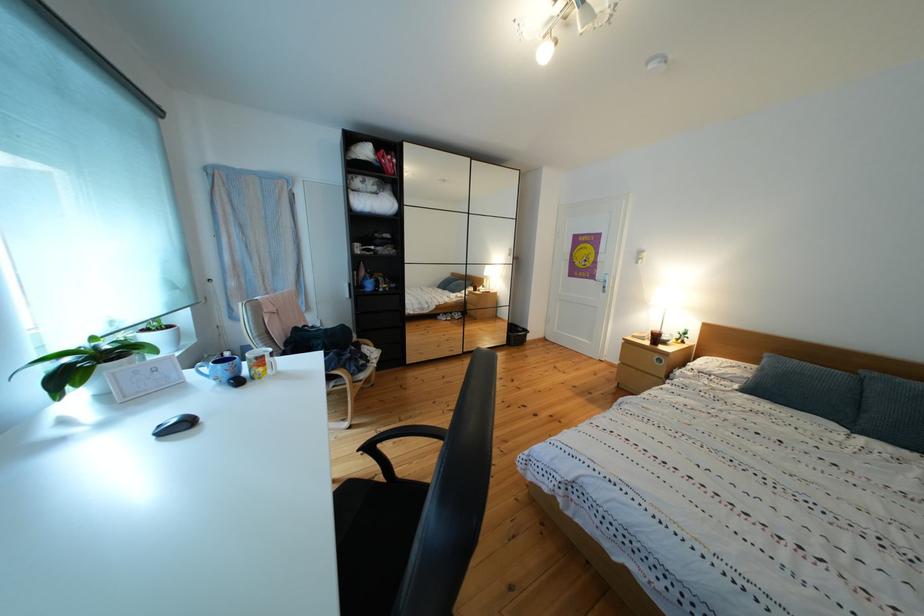
This screenshot has height=616, width=924. I want to click on wooden chair sitting surface, so click(371, 544).